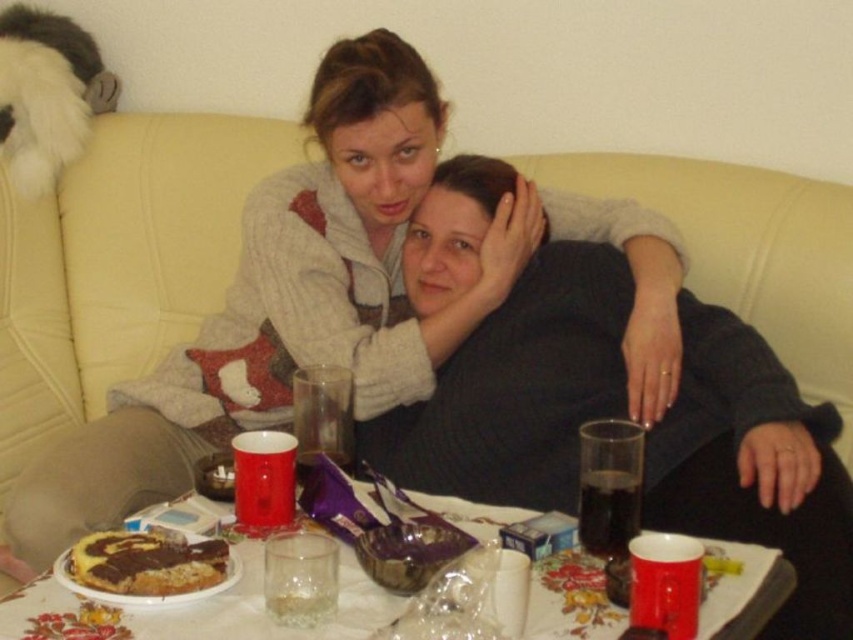
Question: Where is matte glass cup at center located in relation to chocolate cake at lower left in the image?

Choices:
 (A) below
 (B) above

Answer: (B)

Question: Estimate the real-world distances between objects in this image. Which object is closer to the matte glass cup at center?

Choices:
 (A) translucent glass mug at lower center
 (B) chocolate cake at lower left

Answer: (A)

Question: Considering the real-world distances, which object is farthest from the translucent glass mug at lower center?

Choices:
 (A) chocolate cake at lower left
 (B) matte glass cup at center

Answer: (B)

Question: Which of the following is the closest to the observer?

Choices:
 (A) (480, 369)
 (B) (158, 614)
 (C) (144, 563)

Answer: (B)

Question: Can you confirm if translucent glass mug at lower center is positioned below chocolate cake at lower left?

Choices:
 (A) yes
 (B) no

Answer: (A)

Question: Is the position of matte glass cup at center more distant than that of translucent glass mug at lower center?

Choices:
 (A) yes
 (B) no

Answer: (A)